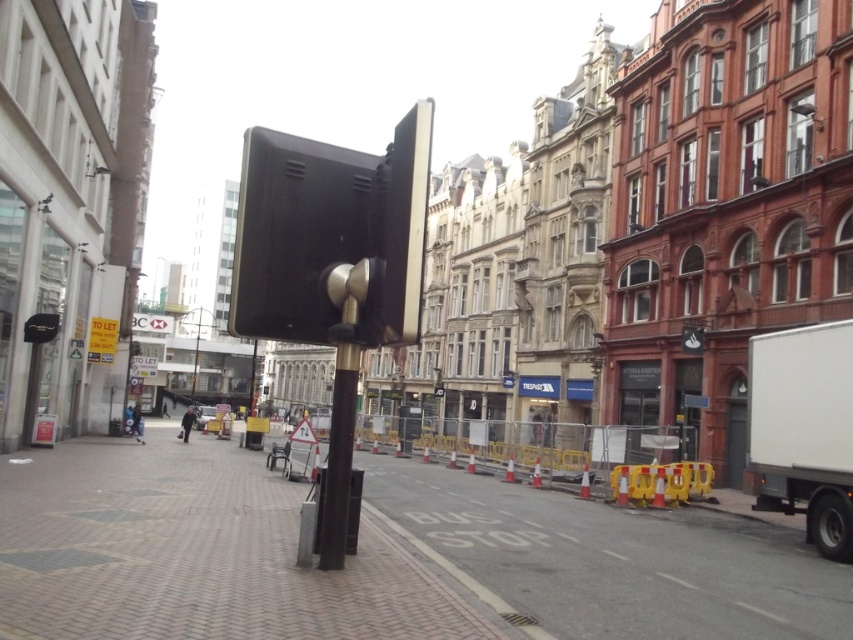
You are a pedestrian standing at the crosswalk. You see the brick pavement at center and the black plastic traffic light at center. Which object is closer to the ground?

The brick pavement at center is closer to the ground because it is below the black plastic traffic light at center.

You are a delivery driver who needs to park your truck exactly 30 feet away from the black matte pole at center. Can you park the white matte truck at right in its current position to meet this requirement?

The white matte truck at right is currently 29.14 feet from the black matte pole at center, which is less than the required 30 feet. Therefore, you cannot park the white matte truck at right in its current position to meet the requirement.